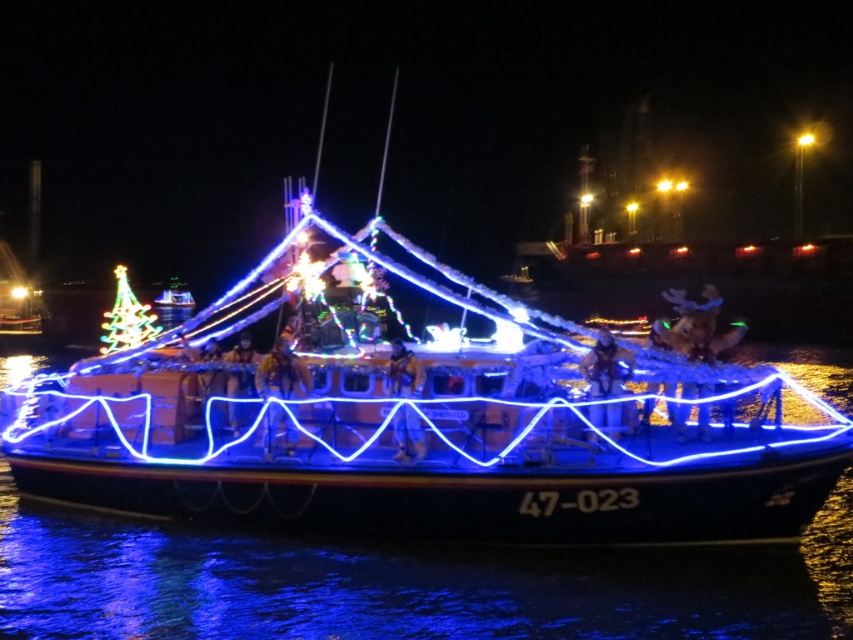
Question: Does metallic gold helmet at center have a lesser width compared to matte gold helmet at center?

Choices:
 (A) no
 (B) yes

Answer: (A)

Question: Is metallic gold helmet at center positioned in front of matte gold helmet at center?

Choices:
 (A) yes
 (B) no

Answer: (A)

Question: Among these objects, which one is nearest to the camera?

Choices:
 (A) yellow fabric jacket at center
 (B) blue reflective water at center
 (C) metallic gold helmet at center

Answer: (B)

Question: Does blue reflective water at center lie behind matte gold helmet at center?

Choices:
 (A) yes
 (B) no

Answer: (B)

Question: Which object is positioned farthest from the blue reflective water at center?

Choices:
 (A) matte gold helmet at center
 (B) yellow fabric jacket at center

Answer: (A)

Question: Which is nearer to the leather jacket at center?

Choices:
 (A) metallic gold helmet at center
 (B) yellow fabric jacket at center
 (C) matte gold helmet at center

Answer: (B)